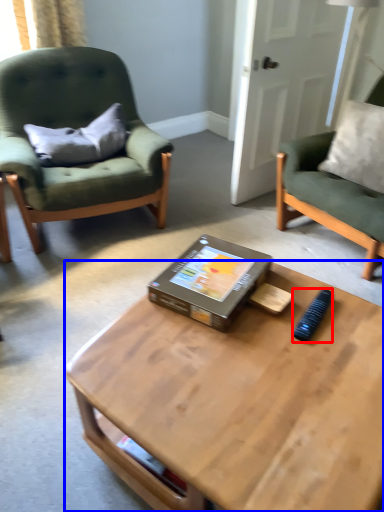
Question: Which of the following is the farthest to the observer, remote control (highlighted by a red box) or coffee table (highlighted by a blue box)?

Choices:
 (A) remote control
 (B) coffee table

Answer: (A)